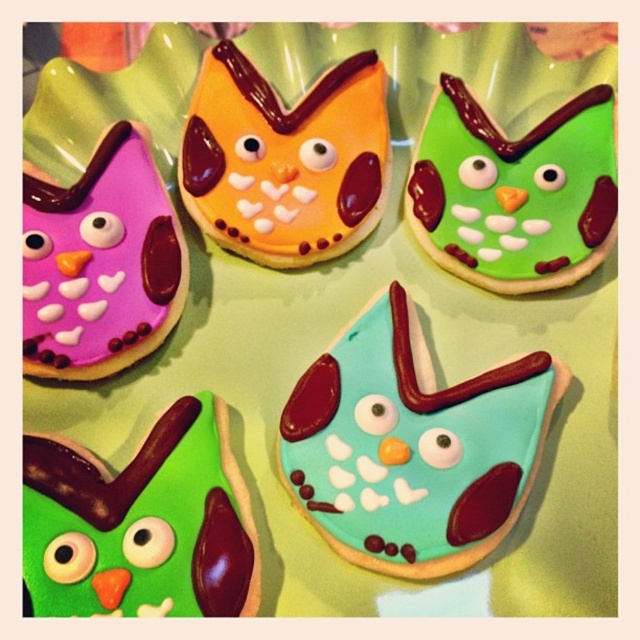
Question: Does green glossy cookie at center-left have a greater width compared to matte purple cookie at upper left?

Choices:
 (A) no
 (B) yes

Answer: (B)

Question: Which of the following is the closest to the observer?

Choices:
 (A) (33, 445)
 (B) (474, 262)
 (C) (323, 429)
 (D) (93, 336)

Answer: (A)

Question: Is teal glossy cookie at center positioned behind green glossy cookie at upper right?

Choices:
 (A) no
 (B) yes

Answer: (A)

Question: Which point is farther from the camera taking this photo?

Choices:
 (A) (316, 188)
 (B) (449, 195)
 (C) (157, 570)
 (D) (154, 304)

Answer: (A)

Question: Does teal glossy cookie at center have a smaller size compared to green glossy cookie at upper right?

Choices:
 (A) no
 (B) yes

Answer: (A)

Question: Which point is farther from the camera taking this photo?

Choices:
 (A) (125, 301)
 (B) (298, 214)
 (C) (429, 426)
 (D) (227, 532)

Answer: (B)